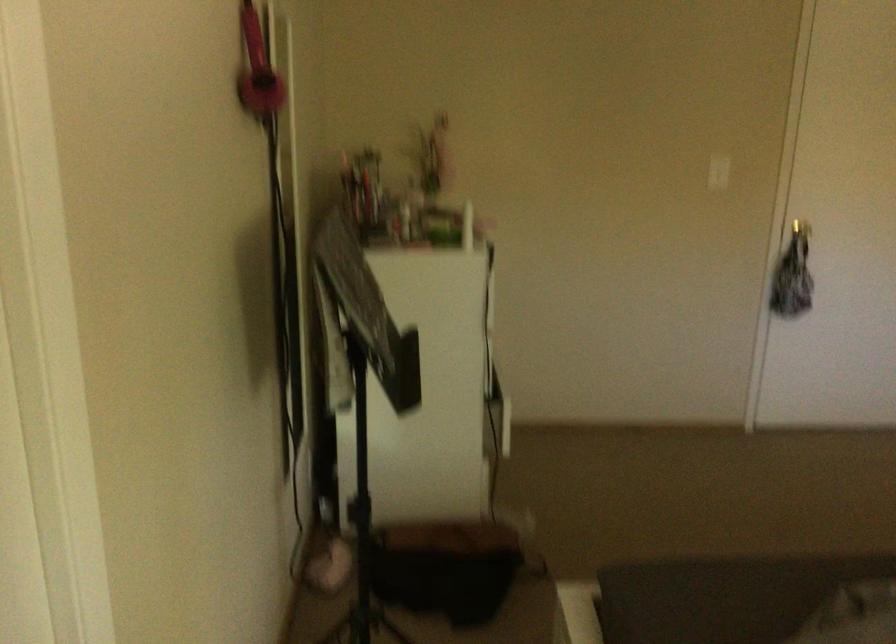
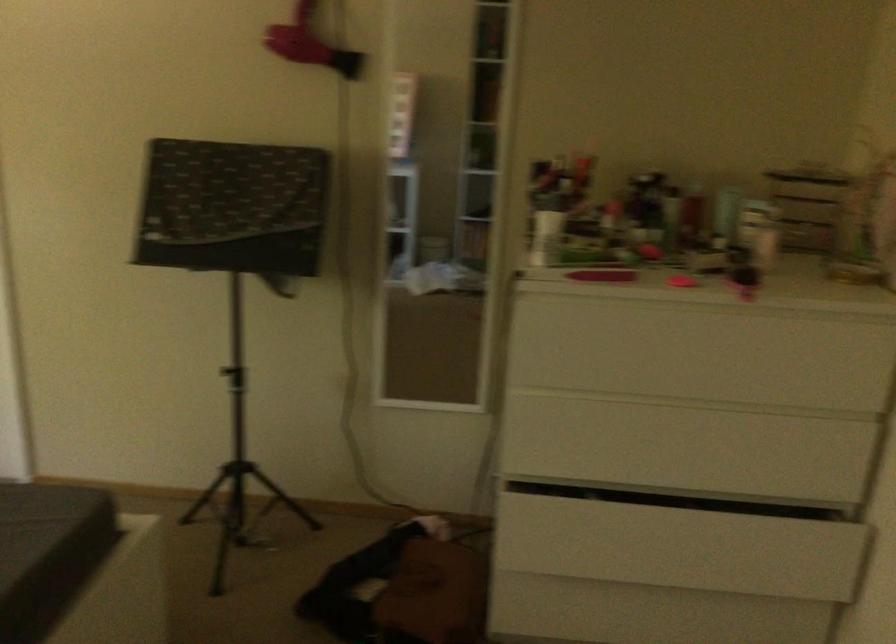
Where in the second image is the point corresponding to (x=277, y=82) from the first image?

(309, 44)